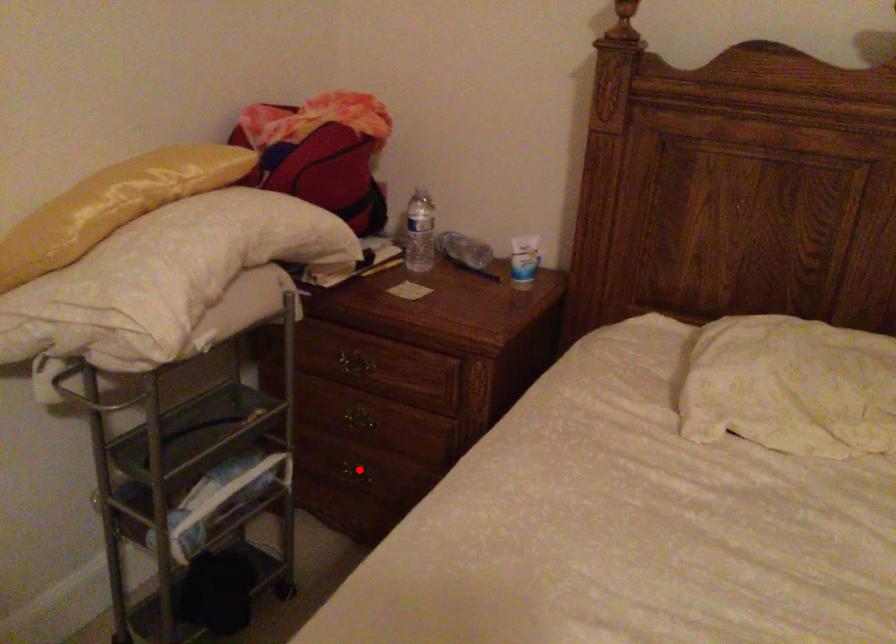
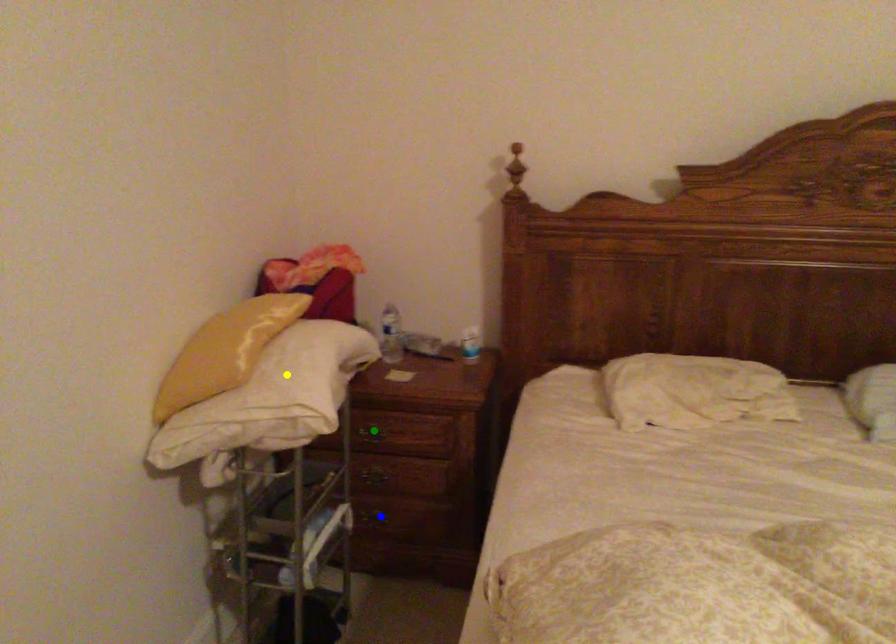
Question: I am providing you with two images of the same scene from different viewpoints. A red point is marked on the first image. You are given multiple points on the second image. Which spot in image 2 lines up with the point in image 1?

Choices:
 (A) green point
 (B) yellow point
 (C) blue point

Answer: (C)